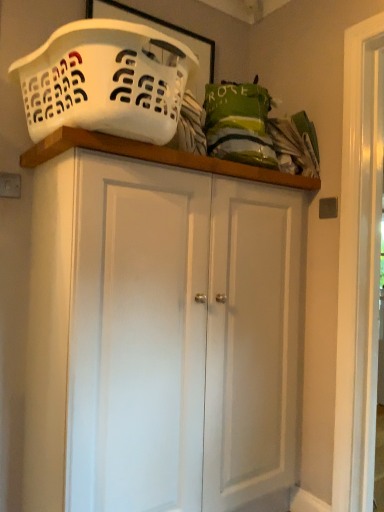
Question: Based on their sizes in the image, would you say white matte cupboard at center is bigger or smaller than white plastic laundry basket at upper left?

Choices:
 (A) small
 (B) big

Answer: (B)

Question: Considering the positions of point (254, 184) and point (56, 83), is point (254, 184) closer or farther from the camera than point (56, 83)?

Choices:
 (A) closer
 (B) farther

Answer: (B)

Question: From their relative heights in the image, would you say white matte cupboard at center is taller or shorter than white plastic laundry basket at upper left?

Choices:
 (A) tall
 (B) short

Answer: (A)

Question: From the image's perspective, is white plastic laundry basket at upper left positioned above or below white matte cupboard at center?

Choices:
 (A) below
 (B) above

Answer: (B)

Question: Considering the relative positions of white plastic laundry basket at upper left and white matte cupboard at center in the image provided, is white plastic laundry basket at upper left to the left or to the right of white matte cupboard at center?

Choices:
 (A) left
 (B) right

Answer: (A)

Question: Is white plastic laundry basket at upper left bigger or smaller than white matte cupboard at center?

Choices:
 (A) big
 (B) small

Answer: (B)

Question: Choose the correct answer: Is white plastic laundry basket at upper left inside white matte cupboard at center or outside it?

Choices:
 (A) inside
 (B) outside

Answer: (B)